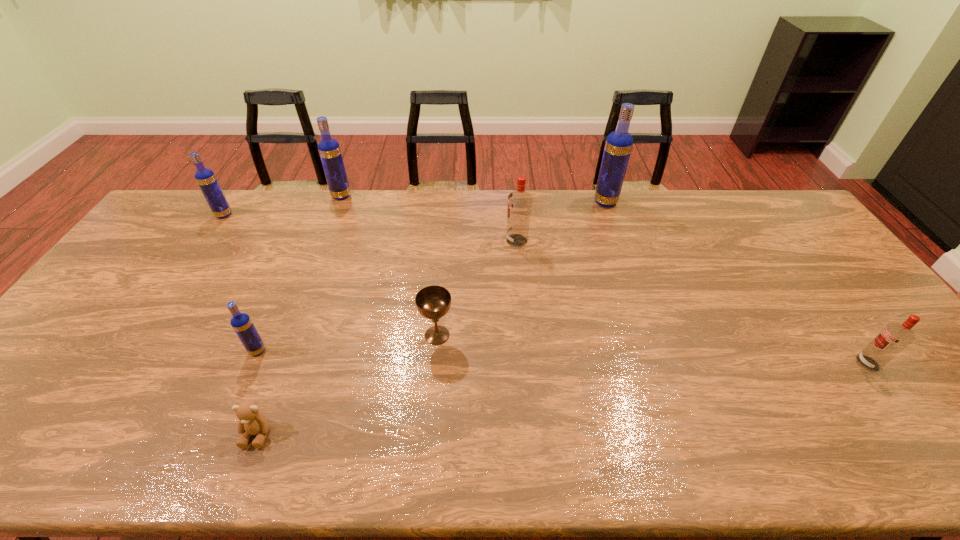
Locate an element on the screen. Image resolution: width=960 pixels, height=540 pixels. vacant point located 0.370m on the front label of the sixth object from left to right is located at coordinates (393, 241).

Identify the location of vacant space located on the front label of the sixth object from left to right. This screenshot has height=540, width=960. (478, 241).

The image size is (960, 540). Find the location of `vacant space located 0.300m on the front label of the rightmost object`. vacant space located 0.300m on the front label of the rightmost object is located at coordinates (737, 363).

Where is `vacant space located 0.300m on the front label of the rightmost object`? Image resolution: width=960 pixels, height=540 pixels. vacant space located 0.300m on the front label of the rightmost object is located at coordinates (737, 363).

The image size is (960, 540). Identify the location of free space located on the front label of the rightmost object. (722, 363).

Locate an element on the screen. free space located 0.210m on the back of the smallest blue vodka is located at coordinates (285, 286).

The width and height of the screenshot is (960, 540). Identify the location of vacant space located on the back of the second shortest object. (443, 267).

Identify the location of object positioned at the near edge. (251, 422).

Find the location of `object present at the right edge`. object present at the right edge is located at coordinates (894, 337).

In the image, there is a desktop. Identify the location of free space at the far edge. (642, 192).